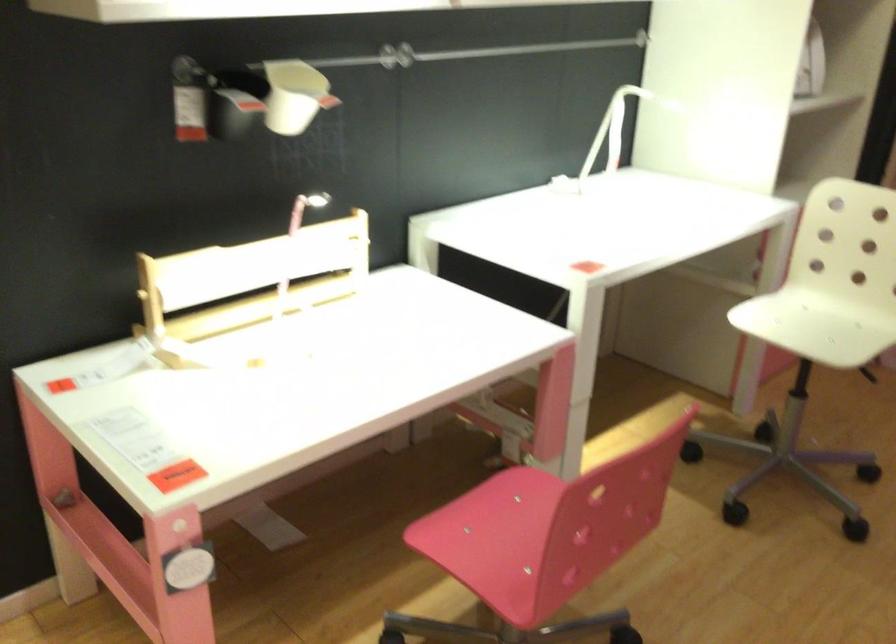
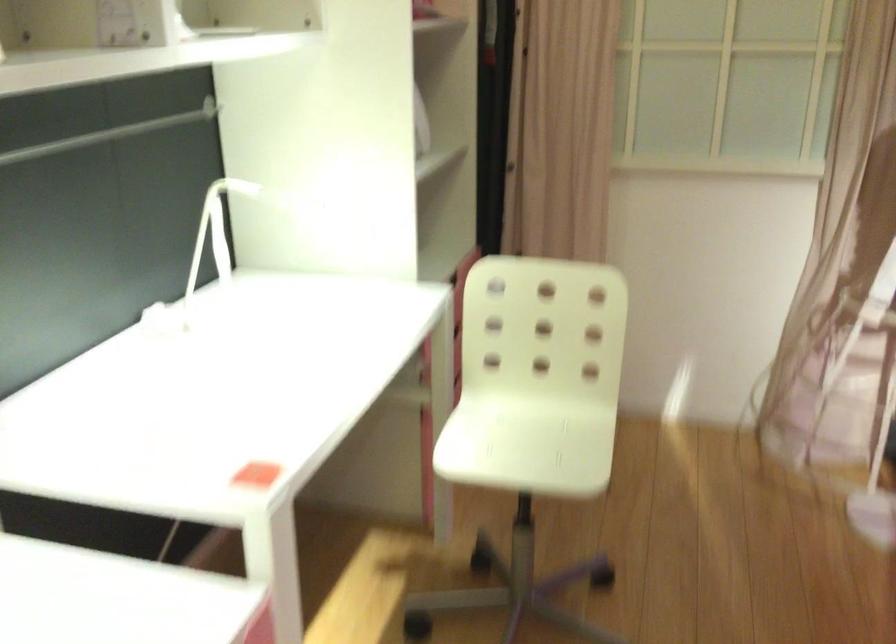
The point at (x=602, y=124) is marked in the first image. Where is the corresponding point in the second image?

(213, 234)